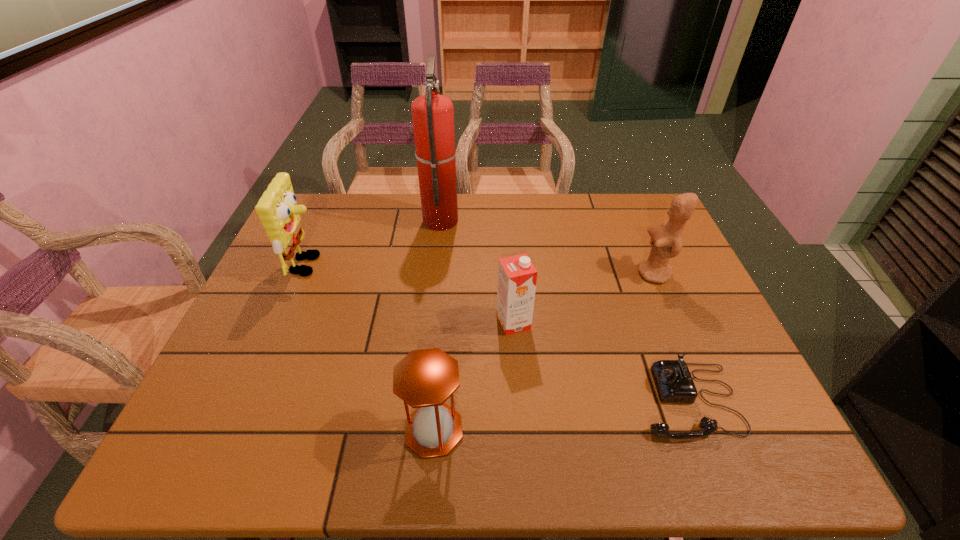
Select which object appears as the fourth closest to the hourglass. Please provide its 2D coordinates. Your answer should be formatted as a tuple, i.e. [(x, y)], where the tuple contains the x and y coordinates of a point satisfying the conditions above.

[(433, 114)]

Where is `vacant area that satisfies the following two spatial constraints: 1. on the face of the leftmost object; 2. on the left side of the third nearest object`? vacant area that satisfies the following two spatial constraints: 1. on the face of the leftmost object; 2. on the left side of the third nearest object is located at coordinates (284, 322).

Locate an element on the screen. The height and width of the screenshot is (540, 960). free point that satisfies the following two spatial constraints: 1. on the face of the leftmost object; 2. on the right side of the carton is located at coordinates (284, 322).

Image resolution: width=960 pixels, height=540 pixels. Find the location of `vacant space that satisfies the following two spatial constraints: 1. on the back side of the third object from right to left; 2. with the nozzle and gauge on the farthest object`. vacant space that satisfies the following two spatial constraints: 1. on the back side of the third object from right to left; 2. with the nozzle and gauge on the farthest object is located at coordinates 506,219.

At what (x,y) coordinates should I click in order to perform the action: click on vacant space that satisfies the following two spatial constraints: 1. with the nozzle and gauge on the hourglass; 2. on the left side of the farthest object. Please return your answer as a coordinate pair (x, y). The width and height of the screenshot is (960, 540). Looking at the image, I should click on (418, 430).

Where is `free space that satisfies the following two spatial constraints: 1. with the nozzle and gauge on the fourth farthest object; 2. on the right side of the farthest object`? free space that satisfies the following two spatial constraints: 1. with the nozzle and gauge on the fourth farthest object; 2. on the right side of the farthest object is located at coordinates (429, 322).